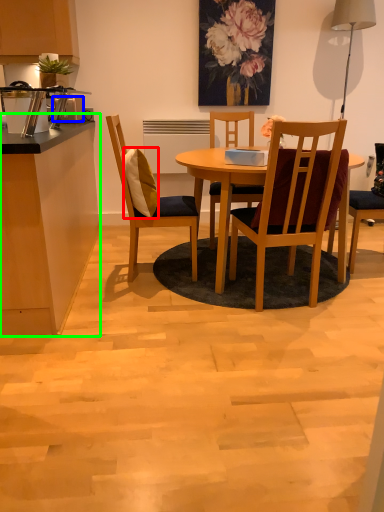
Question: Which object is positioned closest to pillow (highlighted by a red box)? Select from toaster (highlighted by a blue box) and counter top (highlighted by a green box).

Choices:
 (A) toaster
 (B) counter top

Answer: (B)